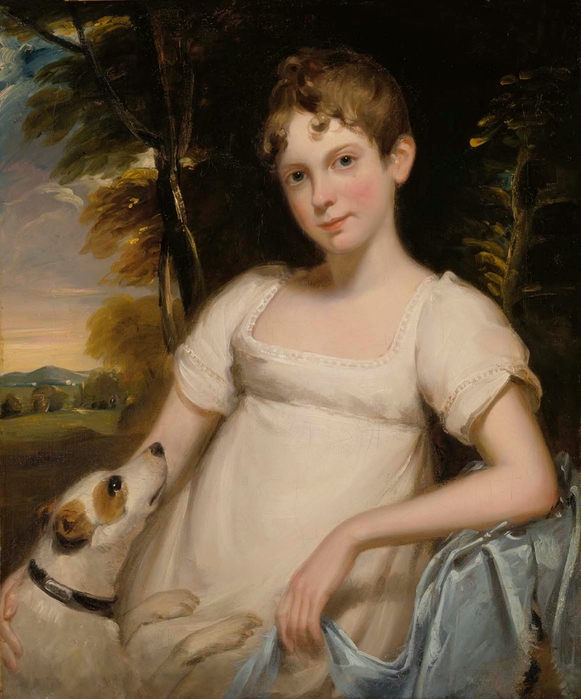
I want to click on painting, so click(x=378, y=539).